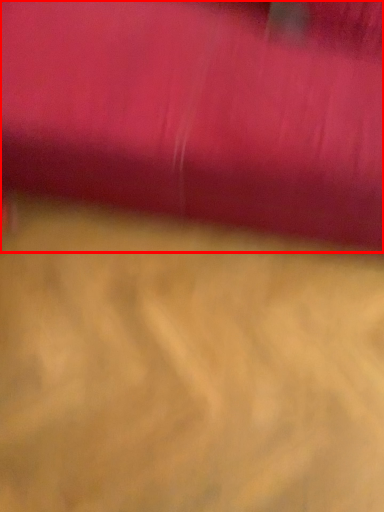
Question: From the image's perspective, where is curtain (annotated by the red box) located relative to surface?

Choices:
 (A) below
 (B) above

Answer: (B)